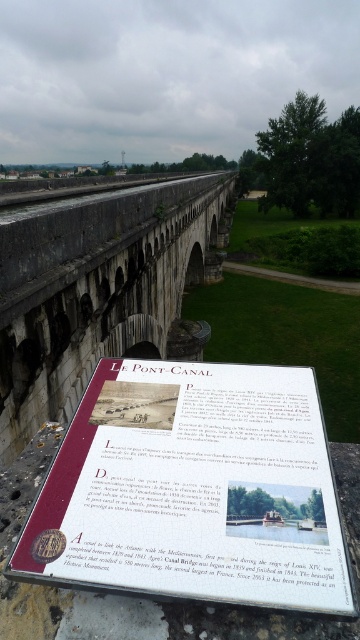
Question: Is white paper sign at center bigger than gray stone aqueduct at center?

Choices:
 (A) yes
 (B) no

Answer: (B)

Question: Which object is closer to the camera taking this photo?

Choices:
 (A) gray stone aqueduct at center
 (B) white paper sign at center

Answer: (B)

Question: Can you confirm if white paper sign at center is positioned to the right of gray stone aqueduct at center?

Choices:
 (A) no
 (B) yes

Answer: (A)

Question: Is white paper sign at center positioned before gray stone aqueduct at center?

Choices:
 (A) no
 (B) yes

Answer: (B)

Question: Which point appears closest to the camera in this image?

Choices:
 (A) (295, 568)
 (B) (140, 214)

Answer: (A)